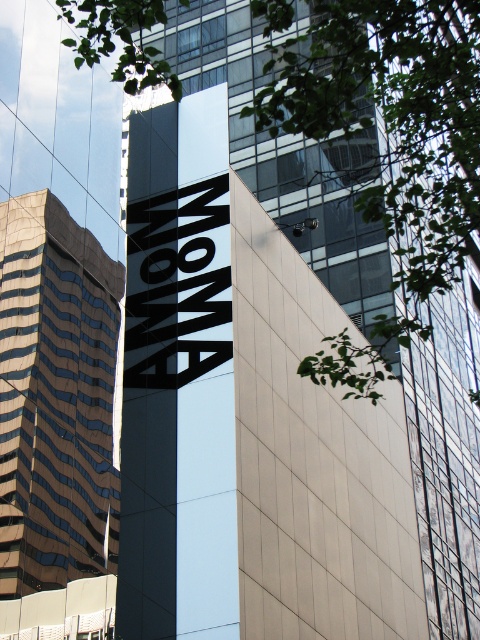
Is green leafy tree at upper center smaller than black matte sign at center?

No.

Locate an element on the screen. This screenshot has height=640, width=480. green leafy tree at upper center is located at coordinates (387, 144).

Which is above, green leafy tree at upper center or brown glass building at left?

Positioned higher is green leafy tree at upper center.

Can you confirm if green leafy tree at upper center is bigger than brown glass building at left?

Yes, green leafy tree at upper center is bigger than brown glass building at left.

This screenshot has width=480, height=640. I want to click on green leafy tree at upper center, so click(x=387, y=144).

Can you confirm if brown glass building at left is bigger than black matte sign at center?

Yes, brown glass building at left is bigger than black matte sign at center.

Is brown glass building at left wider than black matte sign at center?

No.

The image size is (480, 640). Identify the location of brown glass building at left. (56, 397).